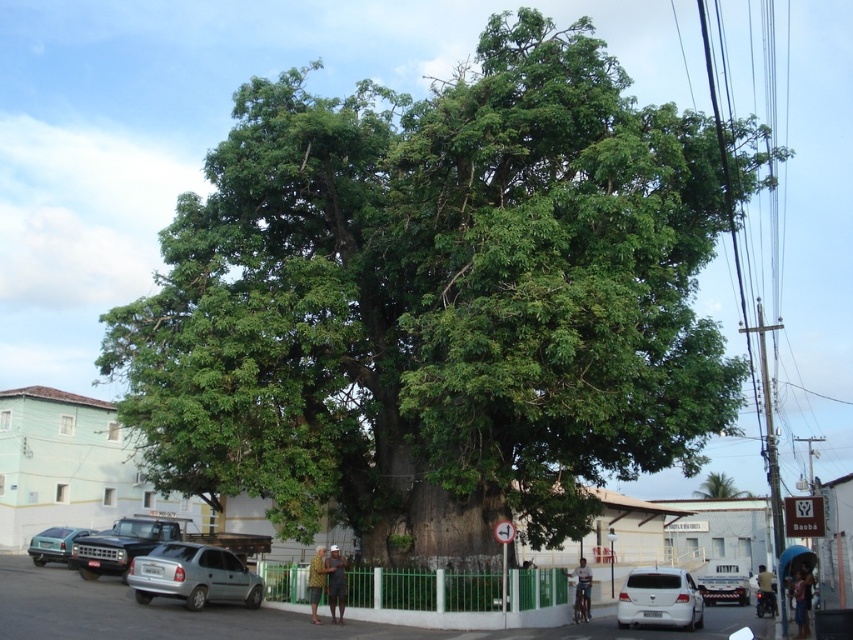
Is silver metallic hatchback at lower left bigger than green leafy tree at center?

No, silver metallic hatchback at lower left is not bigger than green leafy tree at center.

Is point (216, 564) farther from viewer compared to point (717, 477)?

No, (216, 564) is closer to viewer.

Where is `silver metallic hatchback at lower left`? Image resolution: width=853 pixels, height=640 pixels. silver metallic hatchback at lower left is located at coordinates (193, 576).

Does silver metallic hatchback at lower left appear on the right side of matte black truck at left?

Correct, you'll find silver metallic hatchback at lower left to the right of matte black truck at left.

Is silver metallic hatchback at lower left closer to camera compared to matte black truck at left?

Yes, silver metallic hatchback at lower left is closer to the viewer.

What do you see at coordinates (193, 576) in the screenshot? Image resolution: width=853 pixels, height=640 pixels. I see `silver metallic hatchback at lower left` at bounding box center [193, 576].

Find the location of `silver metallic hatchback at lower left`. silver metallic hatchback at lower left is located at coordinates (193, 576).

How distant is white matte van at lower right from green leafy tree at center?

white matte van at lower right and green leafy tree at center are 27.33 meters apart.

Is white matte van at lower right wider than green leafy tree at center?

No, white matte van at lower right is not wider than green leafy tree at center.

Does point (624, 593) lie in front of point (717, 481)?

Yes.

Locate an element on the screen. white matte van at lower right is located at coordinates (659, 598).